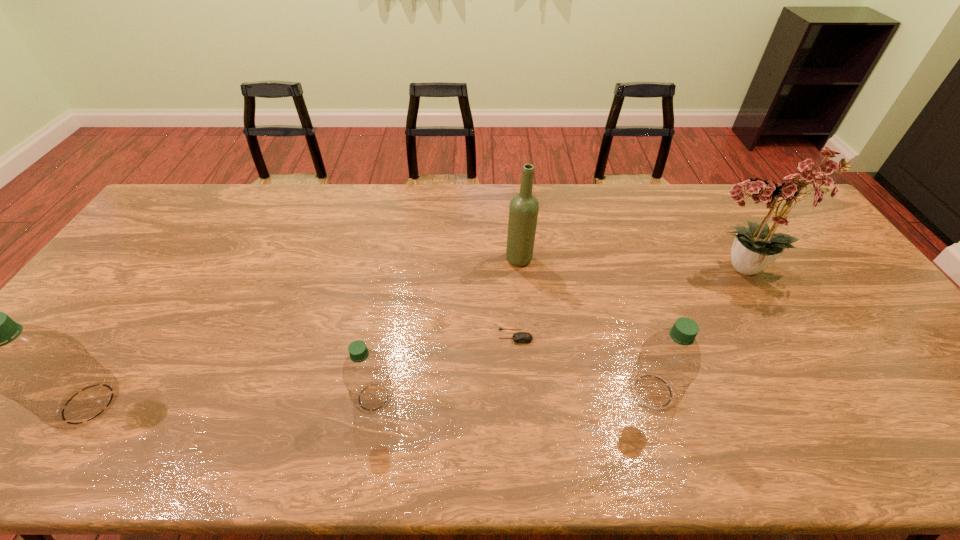
Please point out where to position a new water bottle on the right to maintain spacing. Please provide its 2D coordinates. Your answer should be formatted as a tuple, i.e. [(x, y)], where the tuple contains the x and y coordinates of a point satisfying the conditions above.

[(926, 385)]